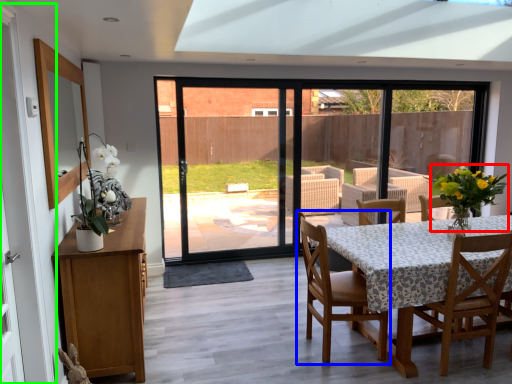
Question: Estimate the real-world distances between objects in this image. Which object is farther from floral arrangement (highlighted by a red box), chair (highlighted by a blue box) or barn door (highlighted by a green box)?

Choices:
 (A) chair
 (B) barn door

Answer: (B)